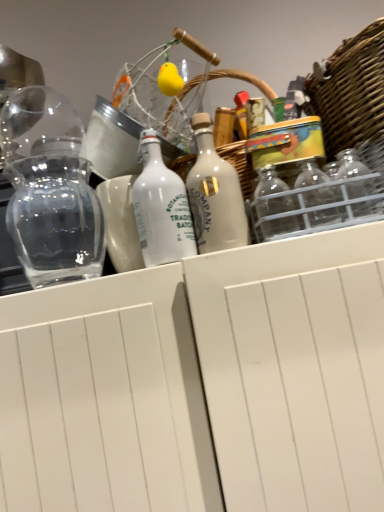
Question: Considering the relative positions of woven wicker basket at upper right and white matte bottle at center, positioned as the 2th bottle in right-to-left order, in the image provided, is woven wicker basket at upper right to the left of white matte bottle at center, positioned as the 2th bottle in right-to-left order, from the viewer's perspective?

Choices:
 (A) yes
 (B) no

Answer: (B)

Question: From the image's perspective, would you say woven wicker basket at upper right is shown under white matte bottle at center, positioned as the 2th bottle in right-to-left order?

Choices:
 (A) no
 (B) yes

Answer: (A)

Question: Is woven wicker basket at upper right in contact with white matte bottle at center, which is the 1th bottle in left-to-right order?

Choices:
 (A) yes
 (B) no

Answer: (B)

Question: From a real-world perspective, does woven wicker basket at upper right stand above white matte bottle at center, which is the 1th bottle in left-to-right order?

Choices:
 (A) yes
 (B) no

Answer: (A)

Question: Is the depth of woven wicker basket at upper right greater than that of white matte bottle at center, which is the 1th bottle in left-to-right order?

Choices:
 (A) yes
 (B) no

Answer: (B)

Question: From the image's perspective, is transparent glass vase at left above or below white matte bottle at center, the first bottle viewed from the right?

Choices:
 (A) below
 (B) above

Answer: (B)

Question: Is transparent glass vase at left wider or thinner than white matte bottle at center, placed as the 2th bottle when sorted from left to right?

Choices:
 (A) wide
 (B) thin

Answer: (A)

Question: Considering the positions of transparent glass vase at left and white matte bottle at center, the first bottle viewed from the right, in the image, is transparent glass vase at left bigger or smaller than white matte bottle at center, the first bottle viewed from the right,?

Choices:
 (A) big
 (B) small

Answer: (A)

Question: From a real-world perspective, is transparent glass vase at left physically located above or below white matte bottle at center, placed as the 2th bottle when sorted from left to right?

Choices:
 (A) below
 (B) above

Answer: (B)

Question: Considering the positions of woven wicker basket at upper right and transparent glass vase at left in the image, is woven wicker basket at upper right bigger or smaller than transparent glass vase at left?

Choices:
 (A) small
 (B) big

Answer: (B)

Question: Is woven wicker basket at upper right taller or shorter than transparent glass vase at left?

Choices:
 (A) short
 (B) tall

Answer: (A)

Question: Considering the relative positions of woven wicker basket at upper right and transparent glass vase at left in the image provided, is woven wicker basket at upper right to the left or to the right of transparent glass vase at left?

Choices:
 (A) right
 (B) left

Answer: (A)

Question: Is woven wicker basket at upper right in front of or behind transparent glass vase at left in the image?

Choices:
 (A) behind
 (B) front

Answer: (B)

Question: From the image's perspective, is woven wicker basket at upper right positioned above or below white matte bottle at center, positioned as the 2th bottle in right-to-left order?

Choices:
 (A) below
 (B) above

Answer: (B)

Question: Is woven wicker basket at upper right bigger or smaller than white matte bottle at center, which is the 1th bottle in left-to-right order?

Choices:
 (A) big
 (B) small

Answer: (A)